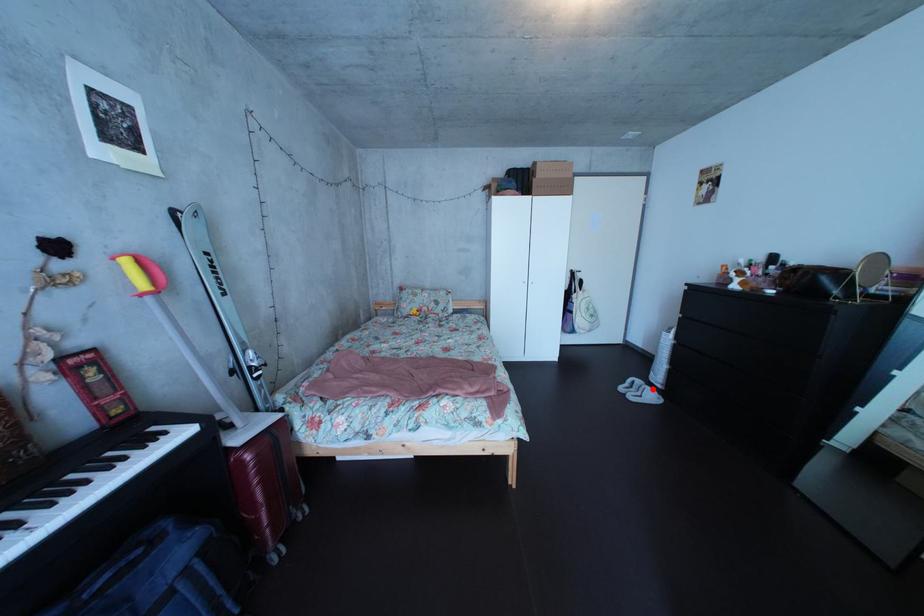
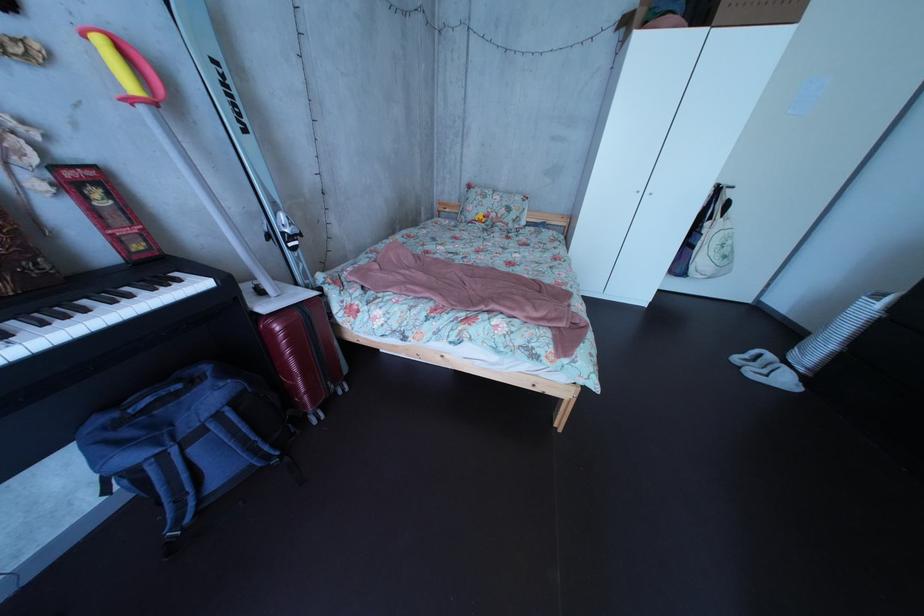
Where in the second image is the point corresponding to the highlighted location from the first image?

(784, 363)